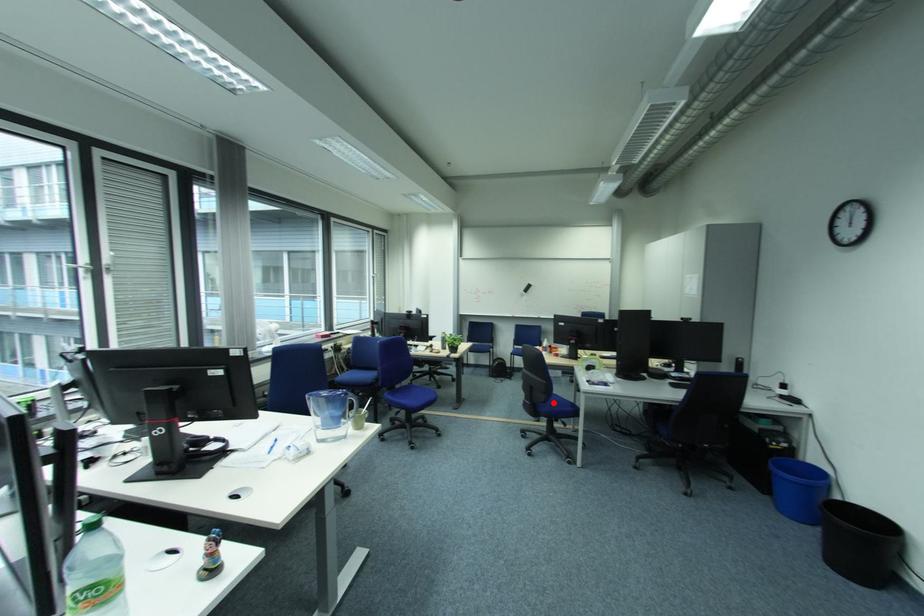
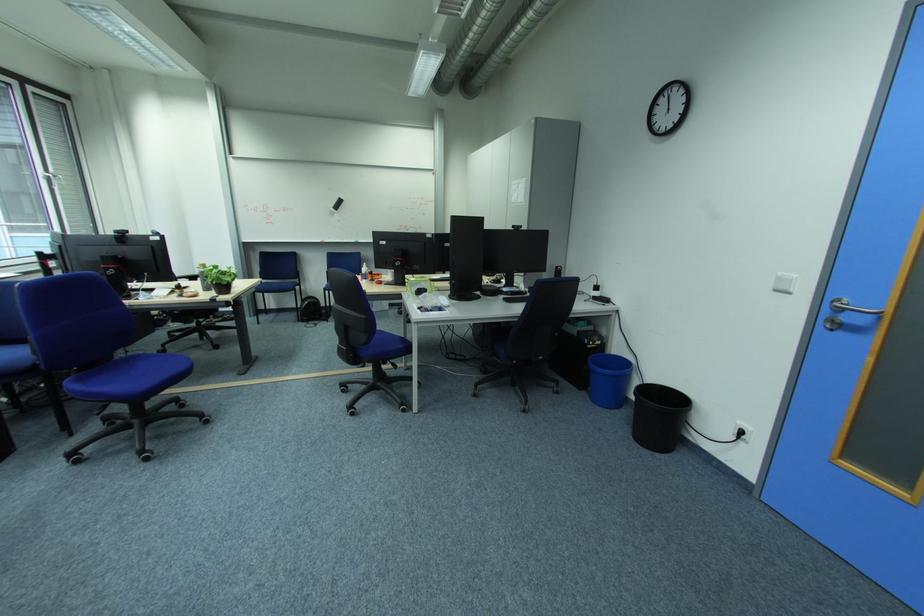
Find the pixel in the second image that matches the highlighted location in the first image.

(375, 344)